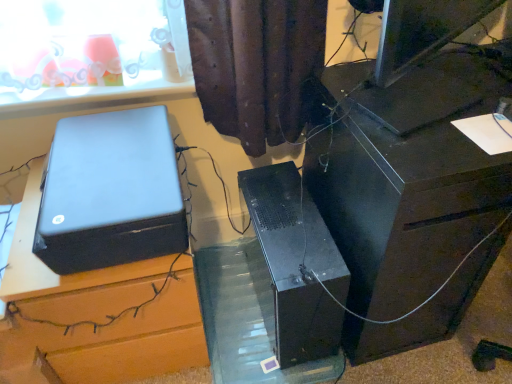
Identify the location of blank space to the left of black matte computer tower at center. (225, 300).